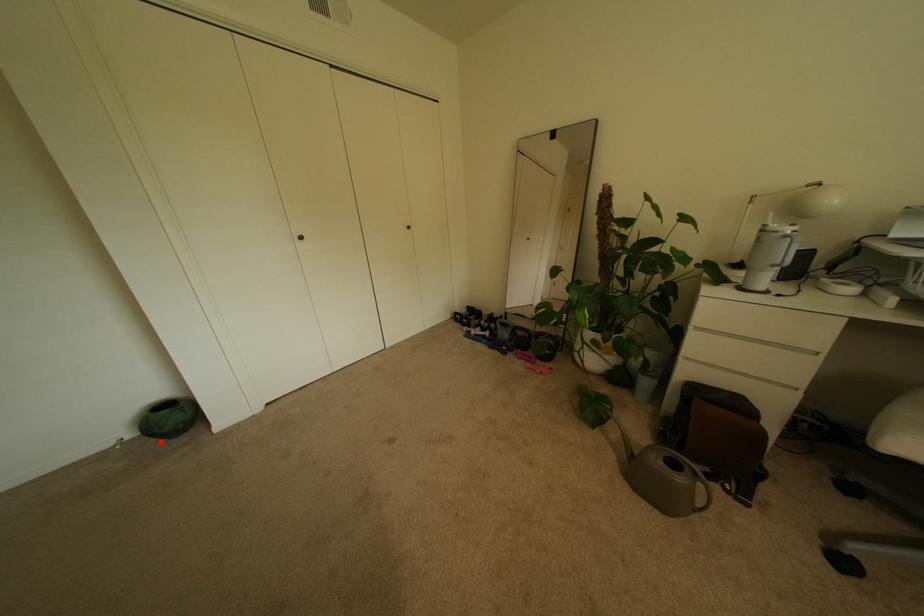
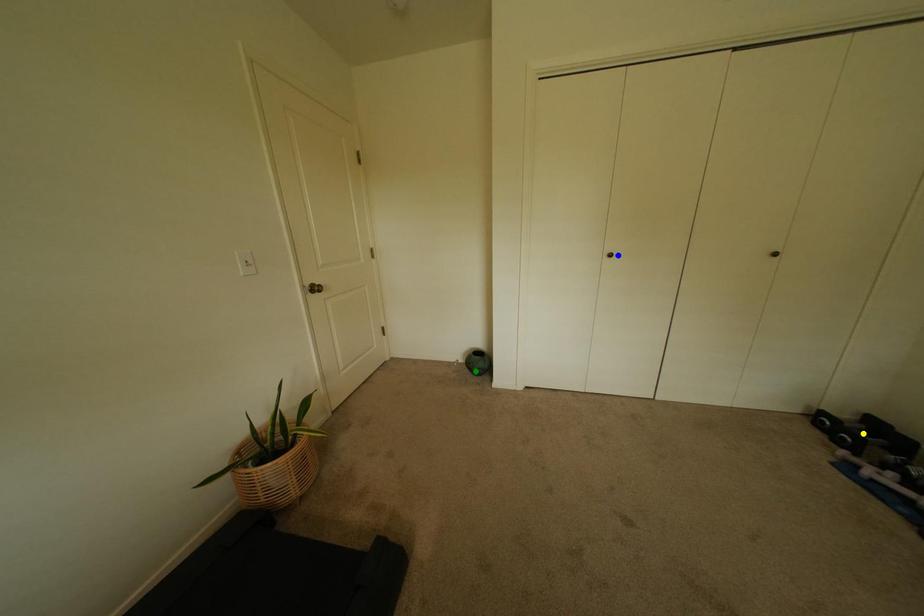
Question: I am providing you with two images of the same scene from different viewpoints. A red point is marked on the first image. You are given multiple points on the second image. Can you choose the point in image 2 that corresponds to the point in image 1?

Choices:
 (A) green point
 (B) blue point
 (C) yellow point

Answer: (A)